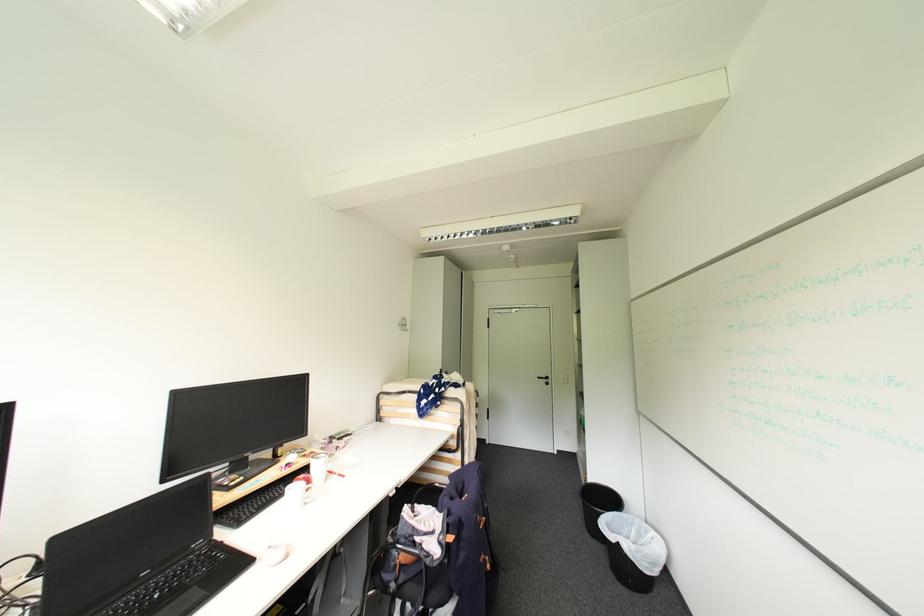
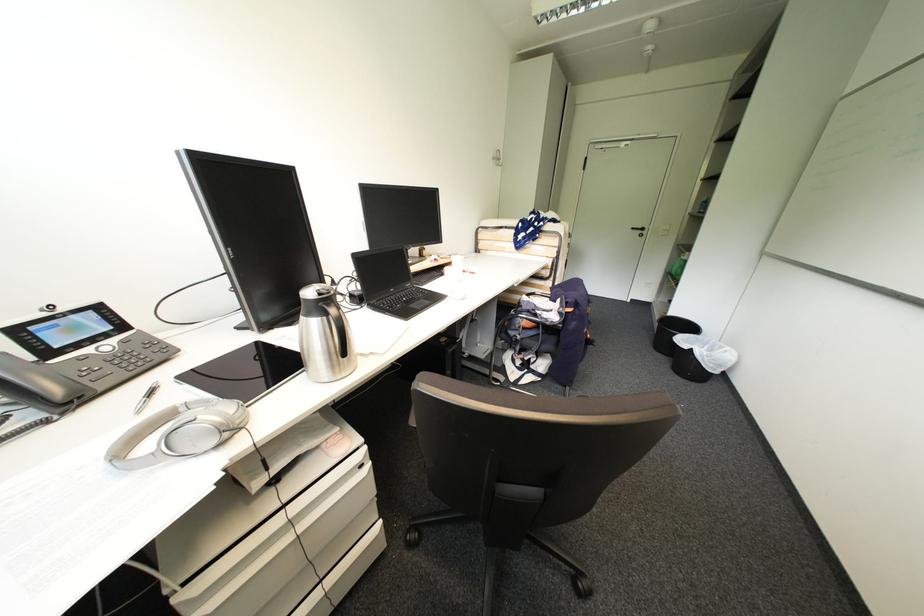
In the second image, find the point that corresponds to the point at 315,466 in the first image.

(456, 262)